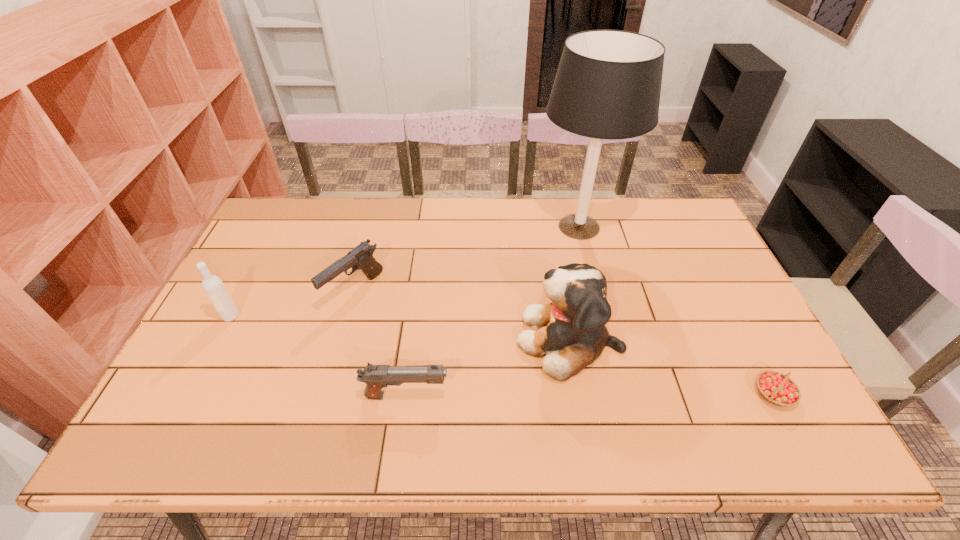
This screenshot has height=540, width=960. I want to click on free space that satisfies the following two spatial constraints: 1. on the front side of the tallest object; 2. at the face of the puppy, so click(608, 340).

The width and height of the screenshot is (960, 540). Identify the location of free location that satisfies the following two spatial constraints: 1. on the front side of the shortest object; 2. in the direction the right gun is aimed. (775, 396).

Where is `free location that satisfies the following two spatial constraints: 1. at the face of the puppy; 2. on the right side of the shortest object`? The width and height of the screenshot is (960, 540). free location that satisfies the following two spatial constraints: 1. at the face of the puppy; 2. on the right side of the shortest object is located at coordinates (579, 394).

This screenshot has width=960, height=540. Find the location of `vacant region that satisfies the following two spatial constraints: 1. at the face of the rightmost object; 2. on the right side of the puppy`. vacant region that satisfies the following two spatial constraints: 1. at the face of the rightmost object; 2. on the right side of the puppy is located at coordinates (579, 394).

What are the coordinates of `vacant space that satisfies the following two spatial constraints: 1. at the face of the strawberry; 2. on the left side of the puppy` in the screenshot? It's located at (579, 394).

Locate an element on the screen. The width and height of the screenshot is (960, 540). blank space that satisfies the following two spatial constraints: 1. at the face of the shortest object; 2. on the left side of the puppy is located at coordinates (579, 394).